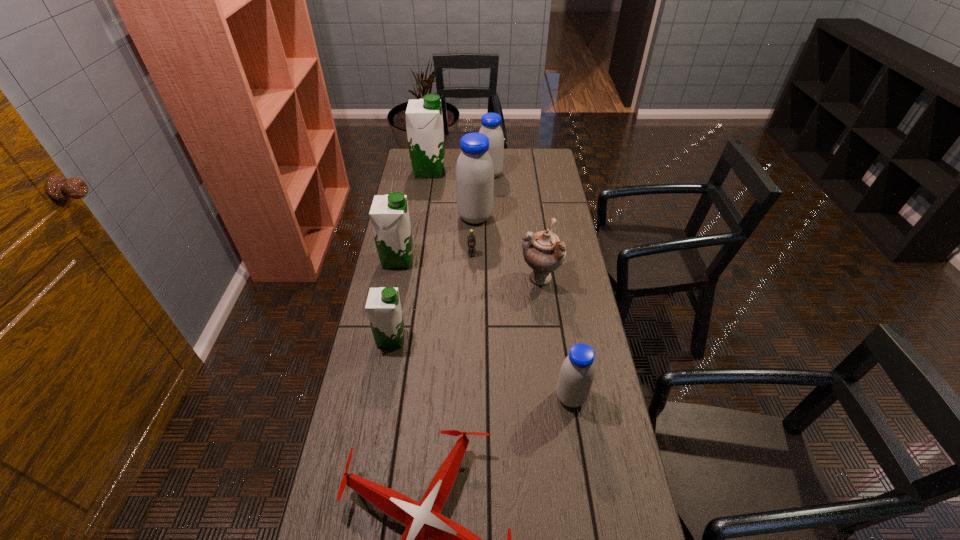
Choose which blue soya milk is the nearest neighbor to the biggest blue soya milk. Please provide its 2D coordinates. Your answer should be formatted as a tuple, i.e. [(x, y)], where the tuple contains the x and y coordinates of a point satisfying the conditions above.

[(491, 122)]

What are the coordinates of `free spot that satisfies the following two spatial constraints: 1. on the front side of the urn; 2. on the front-facing side of the smallest green soya milk` in the screenshot? It's located at (548, 339).

Where is `blank area in the image that satisfies the following two spatial constraints: 1. on the front-facing side of the third nearest soya milk; 2. on the back side of the urn`? This screenshot has width=960, height=540. blank area in the image that satisfies the following two spatial constraints: 1. on the front-facing side of the third nearest soya milk; 2. on the back side of the urn is located at coordinates (394, 278).

Where is `free spot that satisfies the following two spatial constraints: 1. on the front-facing side of the nearest soya milk; 2. on the right side of the second farthest green soya milk`? The height and width of the screenshot is (540, 960). free spot that satisfies the following two spatial constraints: 1. on the front-facing side of the nearest soya milk; 2. on the right side of the second farthest green soya milk is located at coordinates (371, 397).

Locate an element on the screen. The image size is (960, 540). vacant space that satisfies the following two spatial constraints: 1. on the back side of the urn; 2. on the front-facing side of the fourth farthest soya milk is located at coordinates (537, 260).

The width and height of the screenshot is (960, 540). Find the location of `vacant area that satisfies the following two spatial constraints: 1. on the front-facing side of the nearest soya milk; 2. on the left side of the farthest green soya milk`. vacant area that satisfies the following two spatial constraints: 1. on the front-facing side of the nearest soya milk; 2. on the left side of the farthest green soya milk is located at coordinates (395, 397).